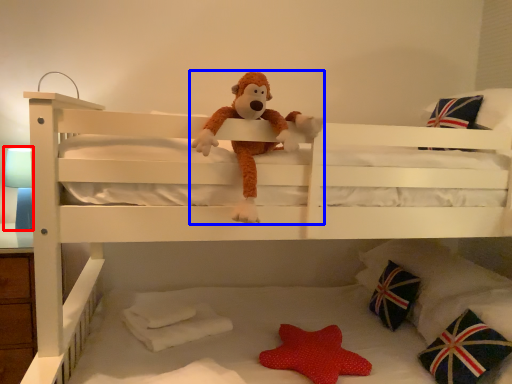
Question: Which point is further to the camera, table lamp (highlighted by a red box) or toy (highlighted by a blue box)?

Choices:
 (A) table lamp
 (B) toy

Answer: (A)